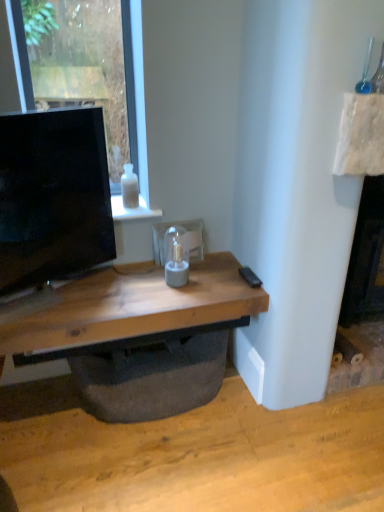
Question: Would you say matte black tv at left is to the left or to the right of transparent glass bottle at upper center in the picture?

Choices:
 (A) right
 (B) left

Answer: (B)

Question: Considering the positions of matte black tv at left and transparent glass bottle at upper center in the image, is matte black tv at left wider or thinner than transparent glass bottle at upper center?

Choices:
 (A) wide
 (B) thin

Answer: (A)

Question: Estimate the real-world distances between objects in this image. Which object is closer to the white glass bottle at upper center?

Choices:
 (A) transparent glass bottle at upper center
 (B) wooden desk at center
 (C) matte black tv at left
 (D) transparent glass window at upper left
 (E) black plastic remote at lower right

Answer: (A)

Question: Which of these objects is positioned farthest from the transparent glass bottle at upper center?

Choices:
 (A) wooden desk at center
 (B) white glass bottle at upper center
 (C) transparent glass window at upper left
 (D) matte black tv at left
 (E) black plastic remote at lower right

Answer: (E)